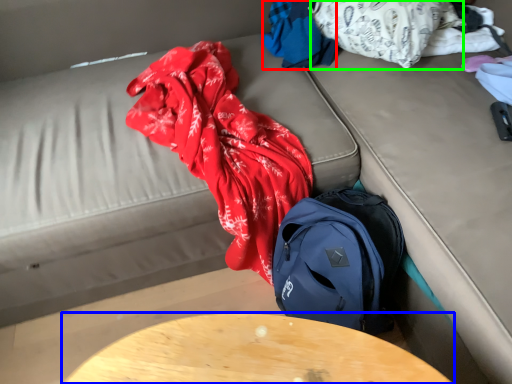
Question: Considering the real-world distances, which object is closest to clothing (highlighted by a red box)? table (highlighted by a blue box) or clothing (highlighted by a green box).

Choices:
 (A) table
 (B) clothing

Answer: (B)